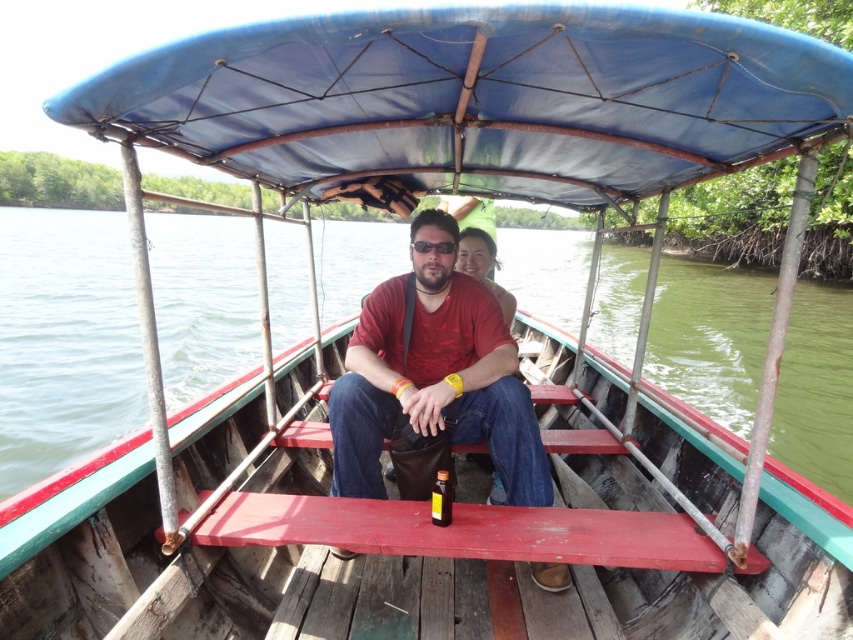
You are a passenger on the boat and want to place your phone on the nearest flat surface. Which object between the green water at boat center and the matte red shirt at center can you use?

The matte red shirt at center is a flat surface, so you can place your phone there. The green water at boat center is located above the shirt and is not a stable surface.